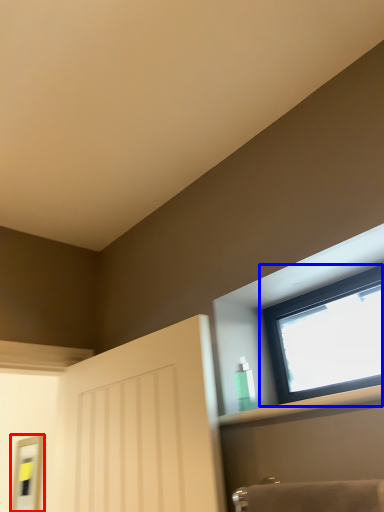
Question: Among these objects, which one is nearest to the camera, mirror (highlighted by a red box) or window (highlighted by a blue box)?

Choices:
 (A) mirror
 (B) window

Answer: (B)